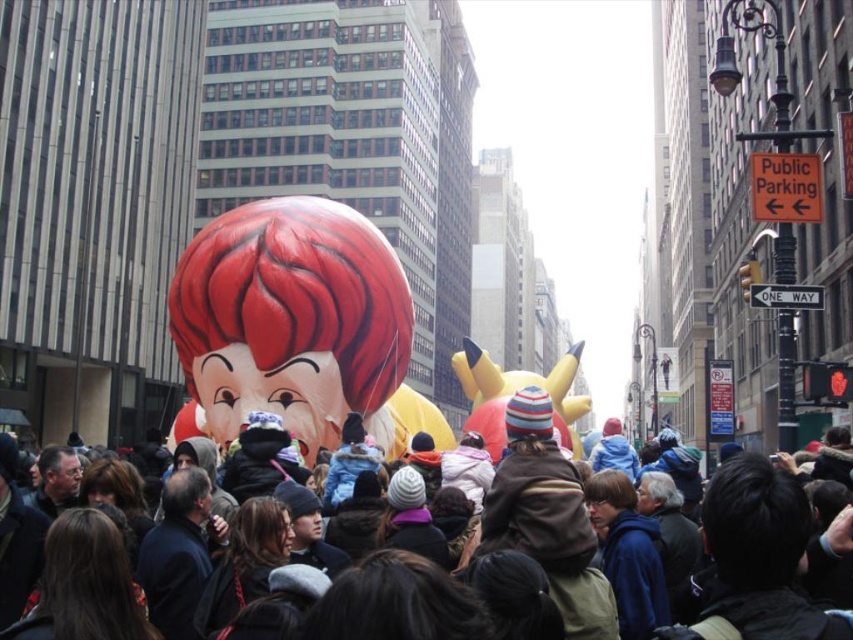
You are standing on the street and see two points marked in the scene. Which point is closer to you, point (372, 280) or point (508, 376)?

Point (372, 280) is in front of point (508, 376), so it is closer to you.

You are a photographer standing at the edge of the crowd. You want to take a photo that includes both the shiny red balloon at center and the yellow matte balloon at center. Given that your camera has a maximum focus range of 20 meters, will both balloons be in focus?

The shiny red balloon at center is 19.75 meters away from the yellow matte balloon at center. Since the distance between them is within the camera maximum focus range of 20 meters, both balloons will be in focus.